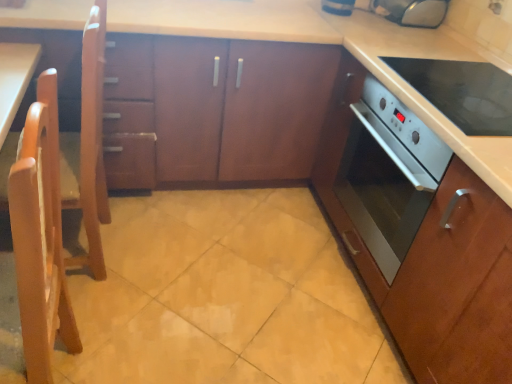
Question: Is white glossy oven at right bigger than light wood chair at left, the 1th chair from the back?

Choices:
 (A) no
 (B) yes

Answer: (A)

Question: Does white glossy oven at right have a greater width compared to light wood chair at left, arranged as the second chair when viewed from the front?

Choices:
 (A) yes
 (B) no

Answer: (A)

Question: Can you confirm if white glossy oven at right is positioned to the right of light wood chair at left, the 1th chair from the back?

Choices:
 (A) yes
 (B) no

Answer: (A)

Question: Is white glossy oven at right touching light wood chair at left, arranged as the second chair when viewed from the front?

Choices:
 (A) yes
 (B) no

Answer: (B)

Question: Does white glossy oven at right turn towards light wood chair at left, arranged as the second chair when viewed from the front?

Choices:
 (A) yes
 (B) no

Answer: (B)

Question: Is white glossy oven at right at the left side of light wood chair at left, arranged as the second chair when viewed from the front?

Choices:
 (A) no
 (B) yes

Answer: (A)

Question: Can you confirm if wooden cabinet at center, acting as the 2th cabinetry starting from the right, is shorter than blue glossy toaster at upper center, marked as the second appliance in a right-to-left arrangement?

Choices:
 (A) no
 (B) yes

Answer: (A)

Question: From the image's perspective, does wooden cabinet at center, placed as the 1th cabinetry when sorted from left to right, appear higher than blue glossy toaster at upper center, marked as the second appliance in a right-to-left arrangement?

Choices:
 (A) yes
 (B) no

Answer: (B)

Question: From a real-world perspective, is wooden cabinet at center, placed as the 1th cabinetry when sorted from left to right, located higher than blue glossy toaster at upper center, marked as the second appliance in a right-to-left arrangement?

Choices:
 (A) yes
 (B) no

Answer: (B)

Question: Can you confirm if wooden cabinet at center, acting as the 2th cabinetry starting from the right, is taller than blue glossy toaster at upper center, which is counted as the 1th appliance, starting from the left?

Choices:
 (A) no
 (B) yes

Answer: (B)

Question: Considering the relative sizes of wooden cabinet at center, placed as the 1th cabinetry when sorted from left to right, and blue glossy toaster at upper center, which is counted as the 1th appliance, starting from the left, in the image provided, is wooden cabinet at center, placed as the 1th cabinetry when sorted from left to right, thinner than blue glossy toaster at upper center, which is counted as the 1th appliance, starting from the left,?

Choices:
 (A) no
 (B) yes

Answer: (A)

Question: Can you confirm if wooden cabinet at center, placed as the 1th cabinetry when sorted from left to right, is bigger than blue glossy toaster at upper center, which is counted as the 1th appliance, starting from the left?

Choices:
 (A) yes
 (B) no

Answer: (A)

Question: From the image's perspective, does yellow matte tile at center appear lower than satin wood oven at center, marked as the second cabinetry in a left-to-right arrangement?

Choices:
 (A) yes
 (B) no

Answer: (A)